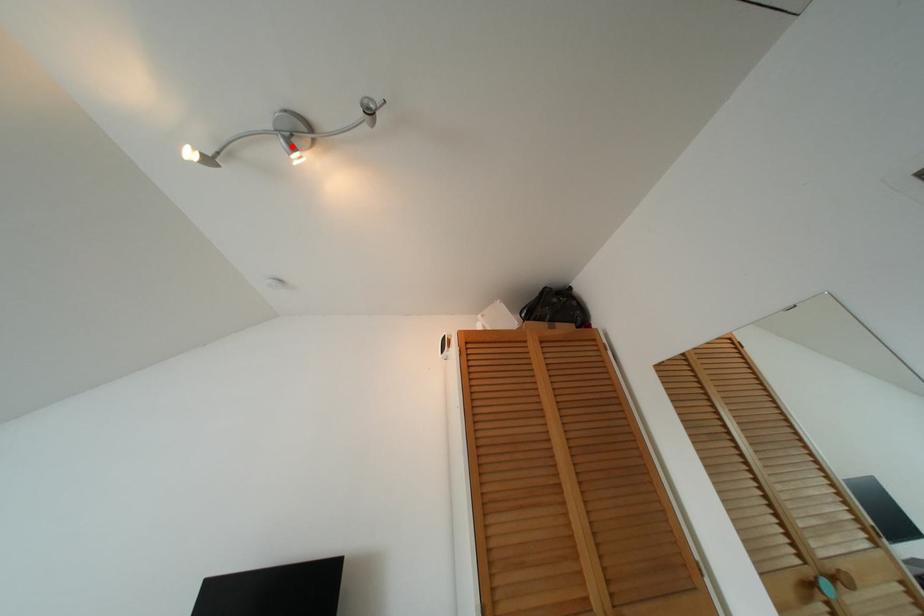
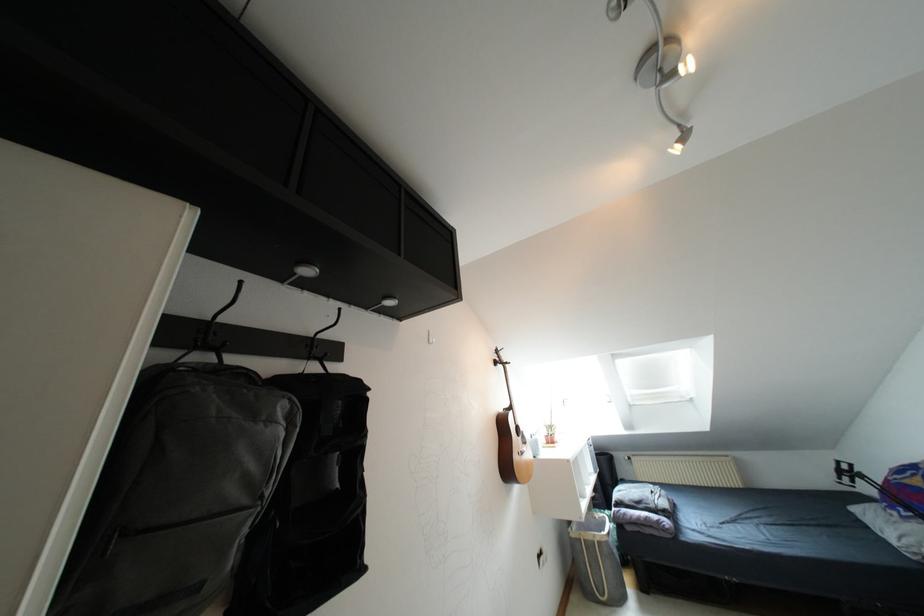
The point at the highlighted location is marked in the first image. Where is the corresponding point in the second image?

(671, 76)